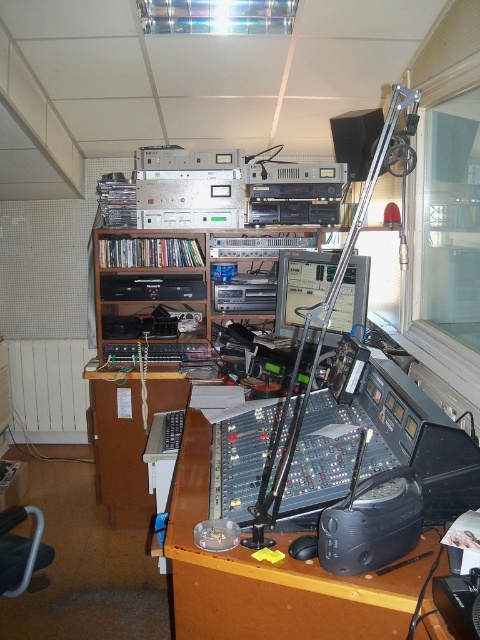
You are a radio host preparing for a live broadcast. You need to place a microphone stand exactly at the point marked by the coordinates point (272, 577). Based on the studio setup described, where will the microphone stand be positioned relative to the mixing console and the wooden shelving unit?

The point (272, 577) corresponds to the brown wooden desk at center. Therefore, placing the microphone stand at this point would position it centrally on the desk, likely between the mixing console and the wooden shelving unit to the left.

You are a technician who needs to reach the brown wooden desk at center to adjust some settings. If your arm can extend 36 inches, can you comfortably reach the desk from where you are standing?

The brown wooden desk at center is 38.02 inches away from the camera, which is slightly beyond your arm reach of 36 inches. You may need to take a step forward to comfortably adjust the settings.

You are setting up a new microphone stand in the studio. The stand requires 2 feet of space. You have two options to place it either on the brown wooden desk at center or near the black matte speaker at upper center. Based on their widths, which surface can accommodate the microphone stand?

The brown wooden desk at center has a greater width than the black matte speaker at upper center. Therefore, the microphone stand requiring 2 feet of space can be placed on the brown wooden desk at center.